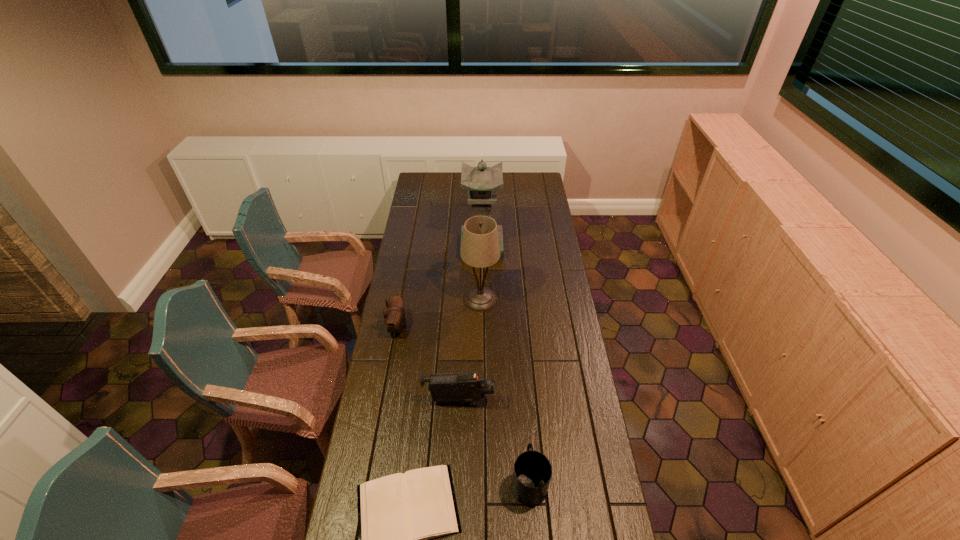
Image resolution: width=960 pixels, height=540 pixels. Find the location of `vacant space located 0.320m on the front-facing side of the fifth nearest object`. vacant space located 0.320m on the front-facing side of the fifth nearest object is located at coordinates (396, 299).

This screenshot has height=540, width=960. What are the coordinates of `vacant region located on the front-facing side of the camcorder` in the screenshot? It's located at (590, 401).

The image size is (960, 540). I want to click on vacant space situated 0.300m with the flap open on the fourth nearest object, so click(x=474, y=327).

The width and height of the screenshot is (960, 540). In order to click on free space located 0.350m on the side of the mug with the handle in this screenshot , I will do `click(520, 375)`.

Where is `free space located on the side of the mug with the handle`? This screenshot has height=540, width=960. free space located on the side of the mug with the handle is located at coordinates (525, 437).

The image size is (960, 540). In order to click on free space located 0.080m on the side of the mug with the handle in this screenshot , I will do `click(525, 437)`.

Locate an element on the screen. This screenshot has width=960, height=540. object situated at the left edge is located at coordinates (394, 317).

Where is `free space at the far edge of the desktop`? The image size is (960, 540). free space at the far edge of the desktop is located at coordinates (499, 190).

In the image, there is a desktop. Where is `free region at the left edge`? The height and width of the screenshot is (540, 960). free region at the left edge is located at coordinates (393, 451).

At what (x,y) coordinates should I click in order to perform the action: click on free space at the right edge of the desktop. Please return your answer as a coordinate pair (x, y). Looking at the image, I should click on coord(547,219).